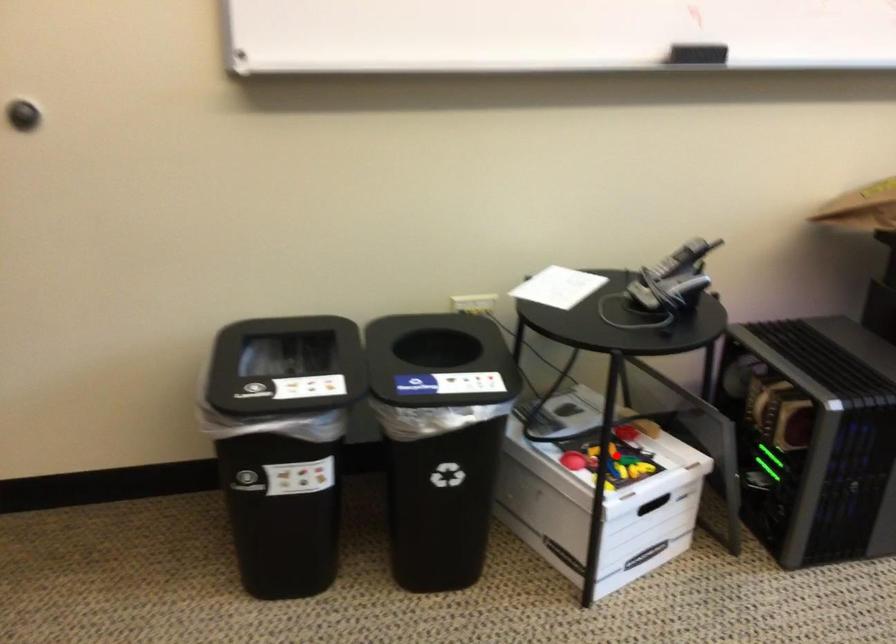
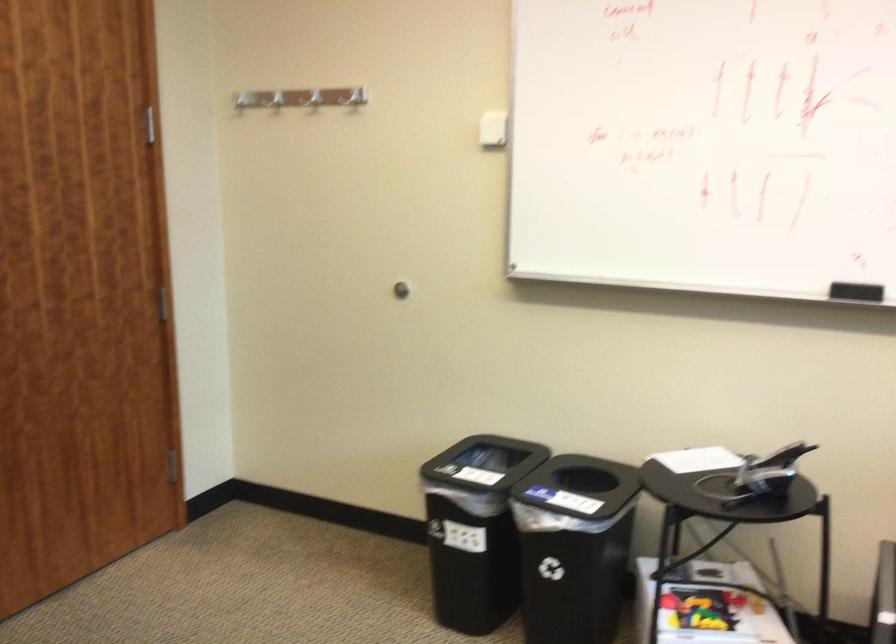
Find the pixel in the second image that matches the highlighted location in the first image.

(701, 609)